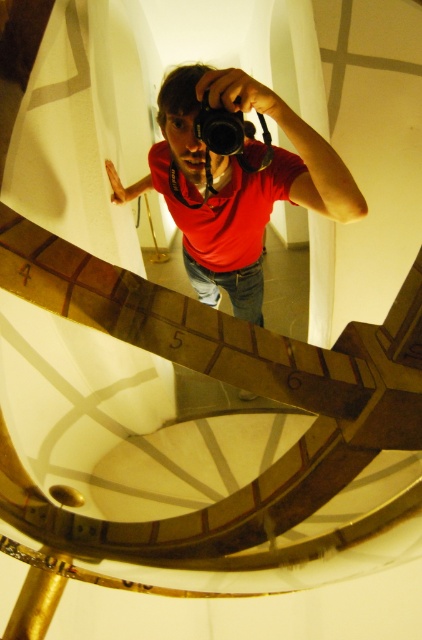
Question: Can you confirm if matte red shirt at center is thinner than black plastic camera at upper center?

Choices:
 (A) no
 (B) yes

Answer: (A)

Question: Among these points, which one is farthest from the camera?

Choices:
 (A) (189, 109)
 (B) (222, 150)

Answer: (A)

Question: Which point is farther to the camera?

Choices:
 (A) matte red shirt at center
 (B) black plastic camera at upper center

Answer: (B)

Question: Can you confirm if matte red shirt at center is positioned to the right of black plastic camera at upper center?

Choices:
 (A) yes
 (B) no

Answer: (A)

Question: Does matte red shirt at center appear under black plastic camera at upper center?

Choices:
 (A) no
 (B) yes

Answer: (B)